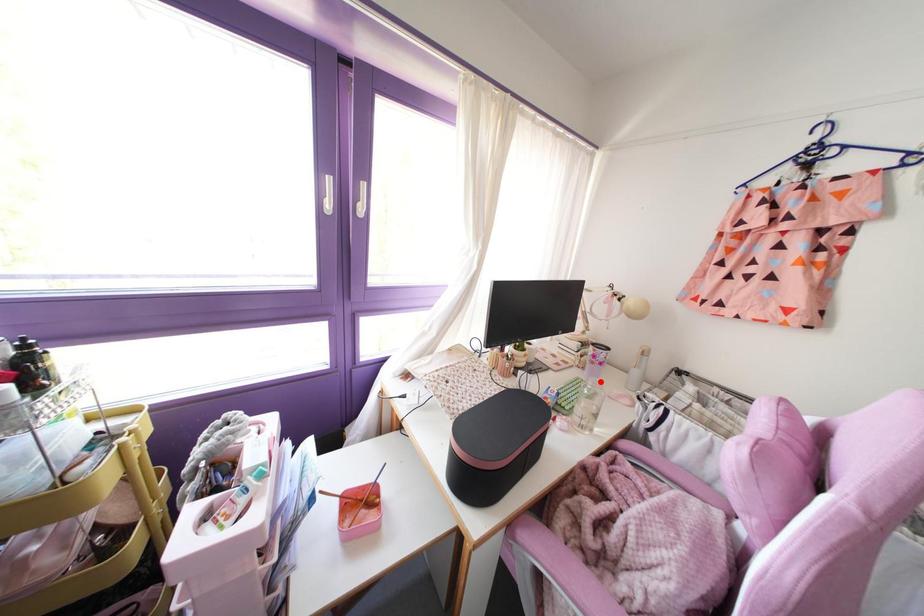
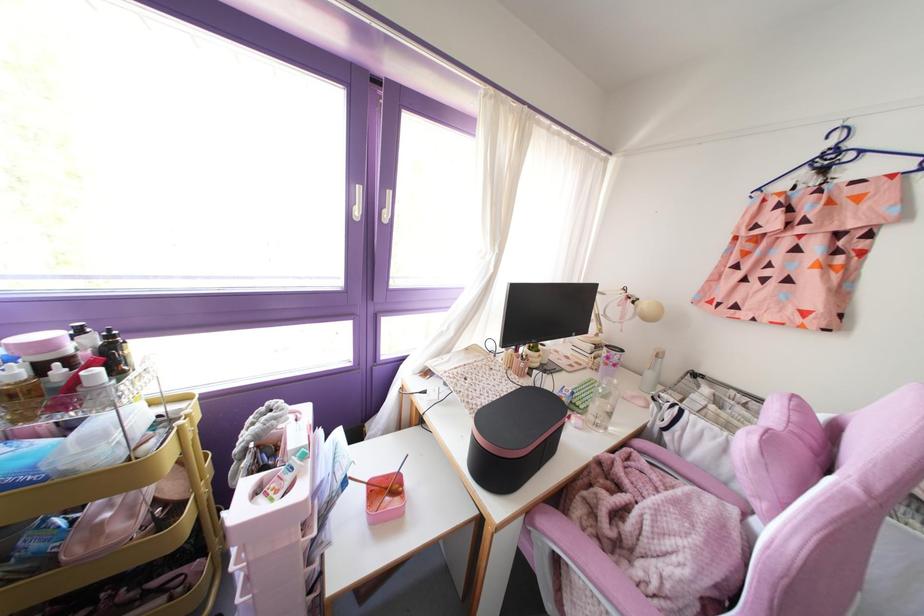
Where in the second image is the point corresponding to the highlighted location from the first image?

(614, 381)